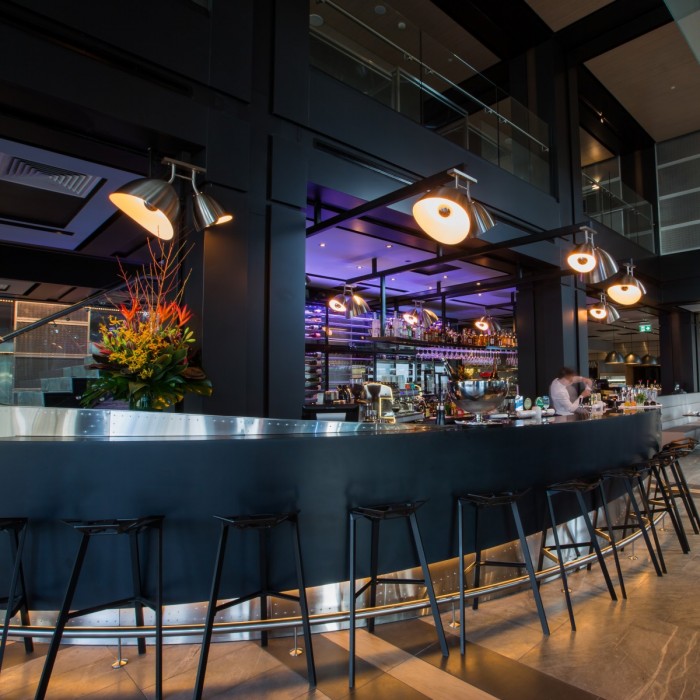
Where is `ac vents`? Image resolution: width=700 pixels, height=700 pixels. ac vents is located at coordinates (46, 183).